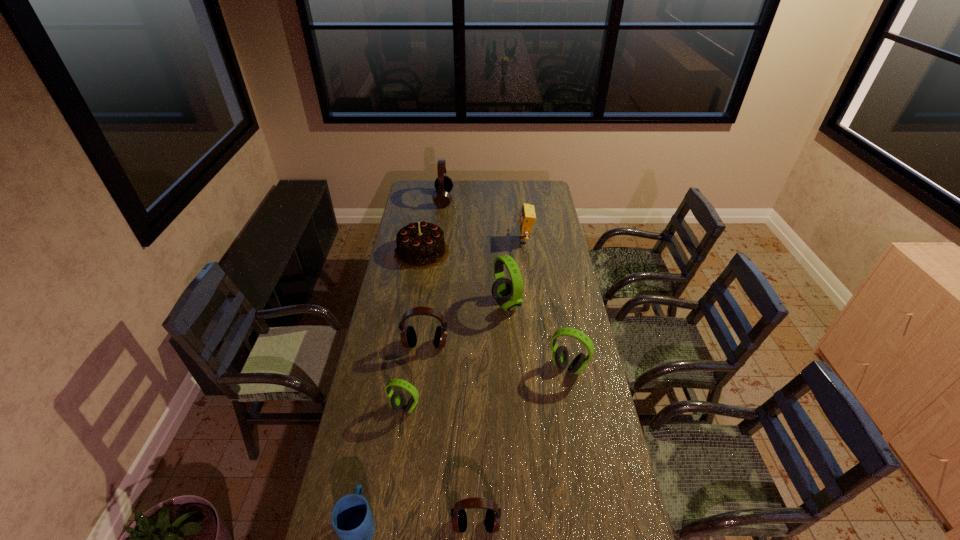
Locate an element on the screen. This screenshot has width=960, height=540. the second closest object relative to the fourth nearest headset is located at coordinates (397, 399).

Locate which headset is the fifth closest to the sponge. Please provide its 2D coordinates. Your answer should be formatted as a tuple, i.e. [(x, y)], where the tuple contains the x and y coordinates of a point satisfying the conditions above.

[(397, 399)]

Image resolution: width=960 pixels, height=540 pixels. I want to click on headset identified as the second closest to the second green headset from left to right, so click(x=560, y=356).

The height and width of the screenshot is (540, 960). What are the coordinates of `the third closest black headset relative to the fifth nearest headset` in the screenshot? It's located at (458, 514).

The width and height of the screenshot is (960, 540). What are the coordinates of `the closest black headset to the sponge` in the screenshot? It's located at (443, 184).

Select which green headset is the closest to the sponge. Please provide its 2D coordinates. Your answer should be formatted as a tuple, i.e. [(x, y)], where the tuple contains the x and y coordinates of a point satisfying the conditions above.

[(508, 292)]

Identify which green headset is the third nearest to the fifth nearest object. Please provide its 2D coordinates. Your answer should be formatted as a tuple, i.e. [(x, y)], where the tuple contains the x and y coordinates of a point satisfying the conditions above.

[(560, 356)]

Identify the location of vacant point that satisfies the following two spatial constraints: 1. on the back side of the rightmost green headset; 2. on the left side of the nearest green headset. (x=411, y=367).

The height and width of the screenshot is (540, 960). What are the coordinates of `vacant position in the image that satisfies the following two spatial constraints: 1. on the ear pads of the rightmost green headset; 2. on the right side of the third farthest headset` in the screenshot? It's located at (422, 367).